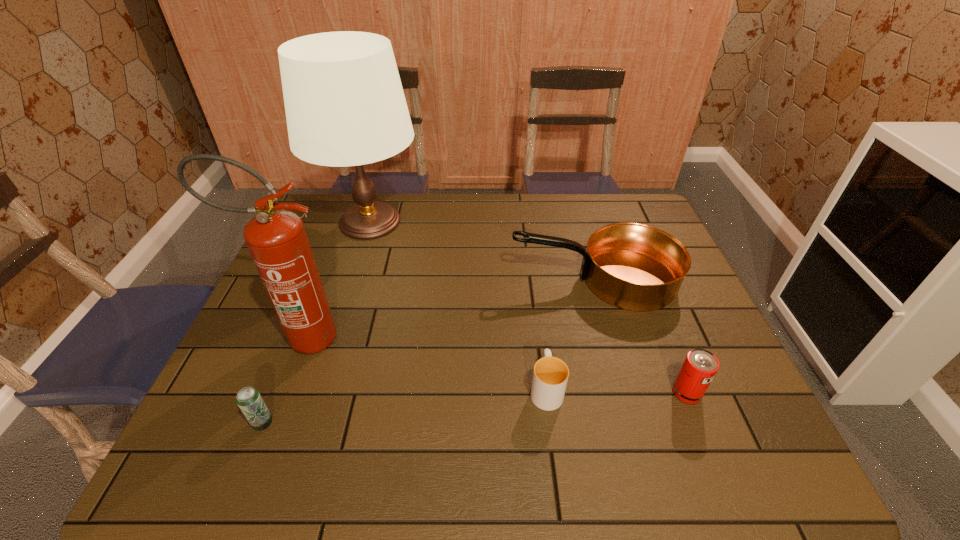
Find the location of `free space between the frying pan and the lamp`. free space between the frying pan and the lamp is located at coordinates (482, 251).

Find the location of `vacant space in between the cup and the third farthest object`. vacant space in between the cup and the third farthest object is located at coordinates (424, 363).

Identify the location of free space between the lamp and the third farthest object. The height and width of the screenshot is (540, 960). (336, 280).

This screenshot has height=540, width=960. What are the coordinates of `free space between the fourth shortest object and the cup` in the screenshot? It's located at (570, 334).

Locate an element on the screen. The width and height of the screenshot is (960, 540). free space between the third farthest object and the third tallest object is located at coordinates (447, 308).

The height and width of the screenshot is (540, 960). I want to click on vacant point located between the third farthest object and the nearest object, so click(x=282, y=380).

Find the location of a particular element. The image size is (960, 540). vacant area that lies between the cup and the lamp is located at coordinates (458, 305).

This screenshot has width=960, height=540. In order to click on vacant space that's between the fourth shortest object and the lamp in this screenshot , I will do `click(482, 251)`.

You are a GUI agent. You are given a task and a screenshot of the screen. Output one action in this format:
    pyautogui.click(x=<x>, y=<y>)
    Task: Click on the free space between the frying pan and the fourth nearest object
    The image size is (960, 540).
    Given the screenshot: What is the action you would take?
    pyautogui.click(x=447, y=308)

Identify the location of blank region between the frying pan and the lamp. (482, 251).